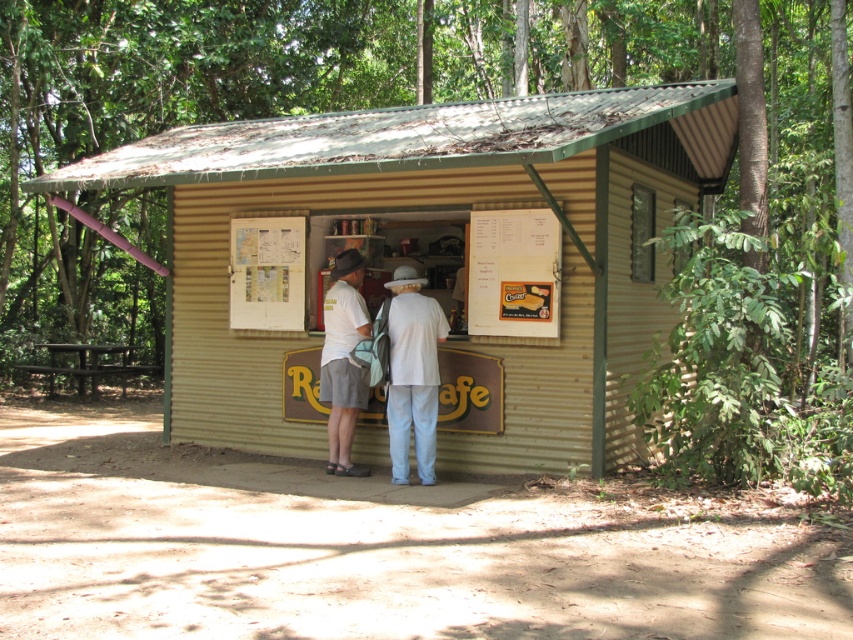
You are a customer at the rustic forest cafe and want to know which of the two people at the center has a shorter shirt. The two people are wearing a white cotton shirt at center and a matte white shirt at center. Can you determine which one is shorter?

The white cotton shirt at center is shorter than the matte white shirt at center, so the person wearing the white cotton shirt at center has the shorter shirt.

You are standing at the entrance of the rustic cafe in the forest. You notice a point marked at coordinates (430, 253). What does this point represent?

The point at (430, 253) represents the corrugated metal hut at center.

You are a customer standing at the entrance of the corrugated metal hut at center. You want to greet the person wearing the white cotton shirt at center. Can you reach them without leaving the immediate area of the entrance?

The distance between the corrugated metal hut at center and the white cotton shirt at center is 7.41 feet. Since this distance is within a reasonable conversational range, you can greet them without leaving the entrance area.